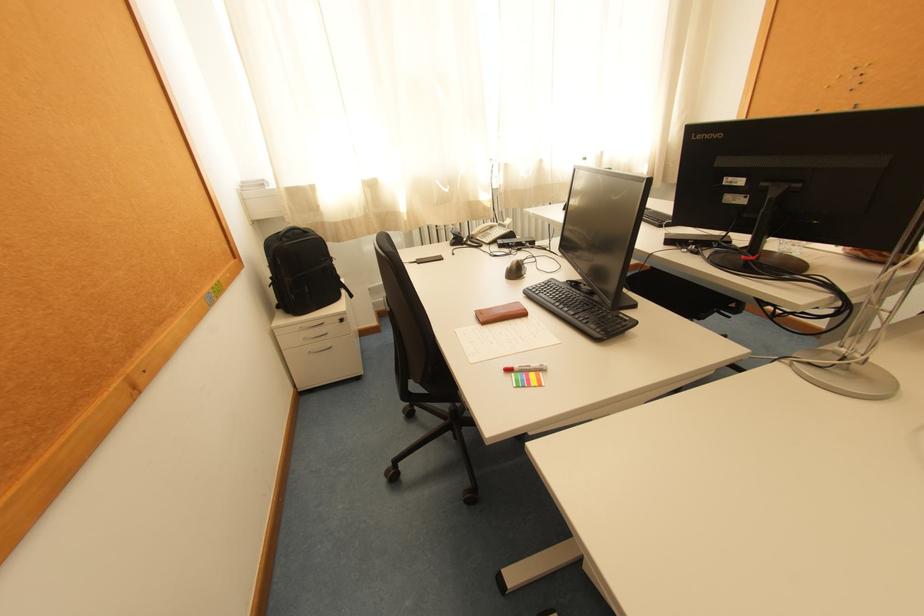
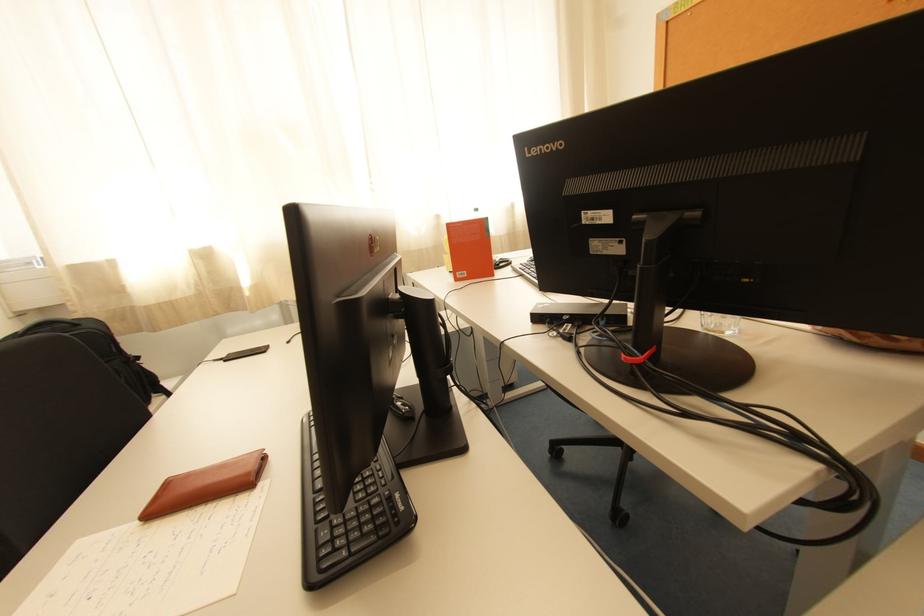
Question: The first image is from the beginning of the video and the second image is from the end. How did the camera likely rotate when shooting the video?

Choices:
 (A) Left
 (B) Right
 (C) Up
 (D) Down

Answer: (C)